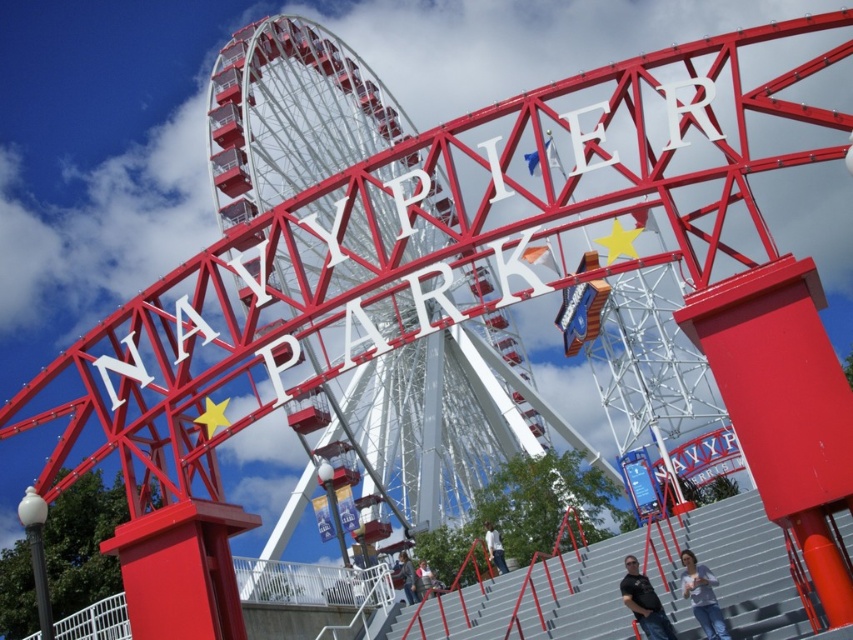
Question: Considering the real-world distances, which object is farthest from the gray metallic stairs at center?

Choices:
 (A) light blue shirt at lower right
 (B) metallic white ferris wheel at center

Answer: (B)

Question: Does metallic white ferris wheel at center lie in front of denim jacket at center?

Choices:
 (A) no
 (B) yes

Answer: (B)

Question: Can you confirm if light blue shirt at lower right is positioned below denim jacket at center?

Choices:
 (A) yes
 (B) no

Answer: (B)

Question: Which object is positioned farthest from the metallic white ferris wheel at center?

Choices:
 (A) gray metallic stairs at center
 (B) denim jacket at center

Answer: (A)

Question: Estimate the real-world distances between objects in this image. Which object is closer to the gray metallic stairs at center?

Choices:
 (A) light blue shirt at lower right
 (B) dark blue jeans at lower center

Answer: (A)

Question: Is dark blue jeans at lower center further to the viewer compared to denim jacket at center?

Choices:
 (A) no
 (B) yes

Answer: (B)